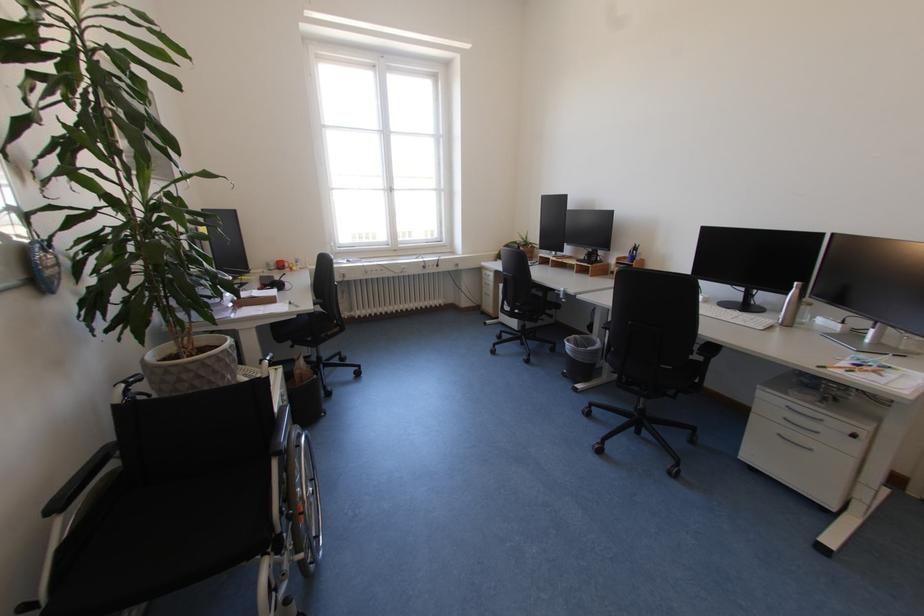
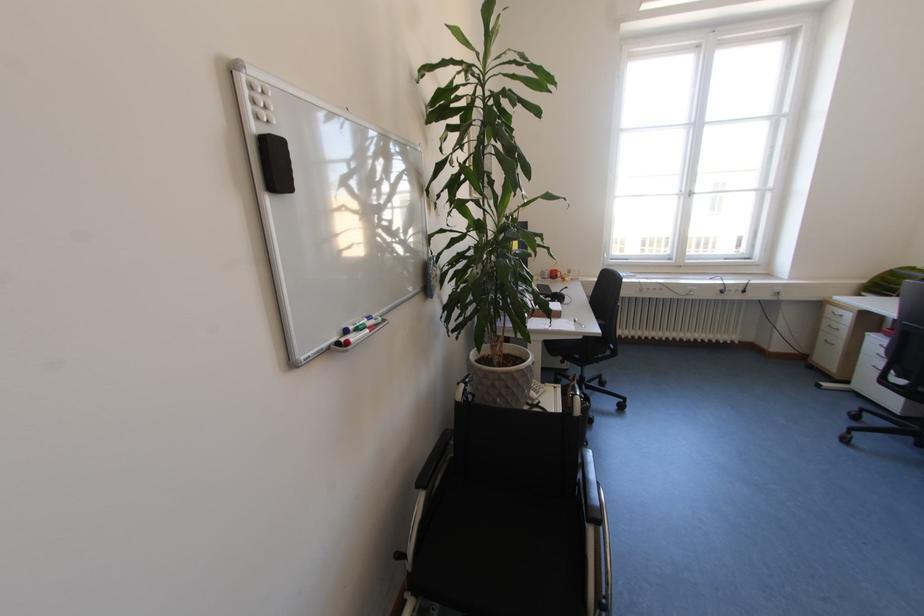
Find the pixel in the second image that matches (493,294) in the first image.

(833, 342)